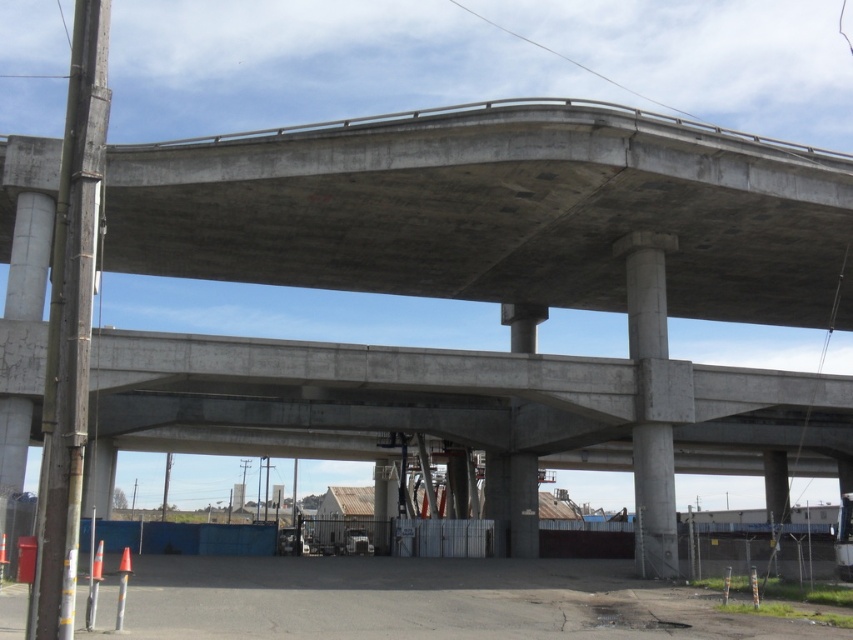
You are a delivery truck driver with a vehicle that is 15 meters long. You need to drive through the space between the concrete highway at lower center and the gray concrete pillar at center. Can your truck fit through this space without any part of it touching either structure?

The distance between the concrete highway at lower center and the gray concrete pillar at center is 15.12 meters. Since the truck is 15 meters long, it can fit through the space as there is enough clearance. However, the driver must ensure proper alignment to avoid contact with either structure.